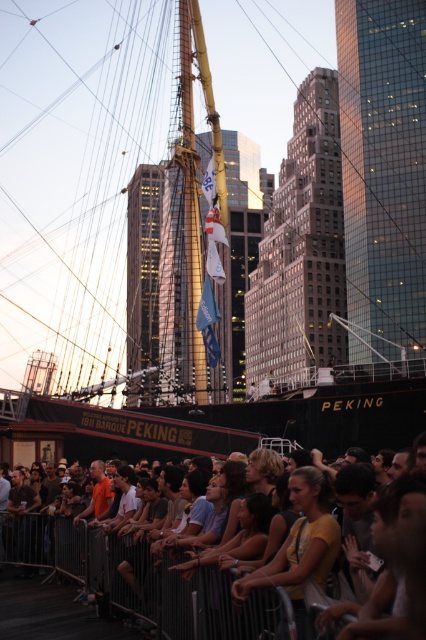
Consider the image. You are a photographer trying to capture a clear photo of the black matte ship at center and the matte yellow shirt at center. Which object should you focus on first if you want to ensure both are in focus without adjusting the camera settings?

The black matte ship at center is taller than the matte yellow shirt at center, so you should focus on the taller object first to ensure depth of field covers both.

You are a photographer trying to capture a clear photo of the black matte ship at center without any obstructions. You notice the matte yellow shirt at center in the scene. Based on their positions, can you take the photo without the shirt blocking the ship?

The black matte ship at center is located above the matte yellow shirt at center, so yes, you can take the photo without the shirt blocking the ship as the ship is positioned higher up.